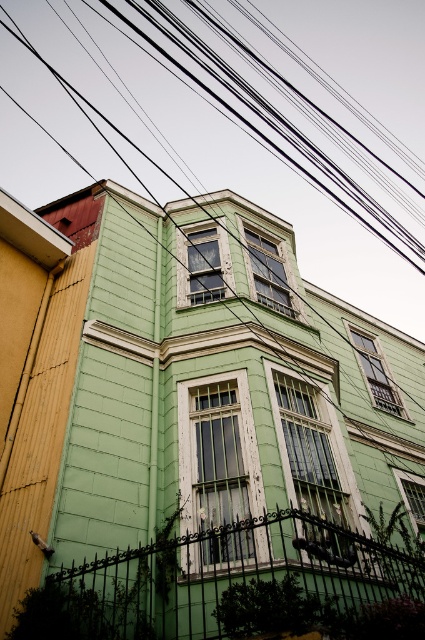
You are standing in front of the building and want to hang a banner between the black wires at upper center and the green painted wood window at center. Can the banner be hung horizontally without touching either object?

The black wires at upper center is much taller than the green painted wood window at center, so there is enough vertical space to hang the banner horizontally between them without touching either object.